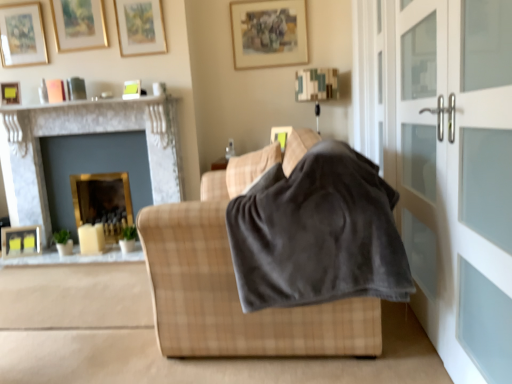
How much space does matte gold picture frame at upper center, the fifth picture frame from the left, occupy horizontally?

The width of matte gold picture frame at upper center, the fifth picture frame from the left, is 1.32 inches.

Measure the distance between point (15, 242) and camera.

Result: Point (15, 242) is 11.64 feet away from camera.

Measure the distance between point (341,336) and camera.

A distance of 5.91 feet exists between point (341,336) and camera.

Measure the distance between point (281, 143) and camera.

Point (281, 143) and camera are 2.56 meters apart from each other.

Describe the element at coordinates (281, 135) in the screenshot. I see `matte gold picture frame at center, which is the seventh picture frame in left-to-right order` at that location.

You are a GUI agent. You are given a task and a screenshot of the screen. Output one action in this format:
    pyautogui.click(x=<x>, y=<y>)
    Task: Click on the matte gold picture frame at upper center, which ranks as the third picture frame in right-to-left order
    Image resolution: width=512 pixels, height=384 pixels.
    Given the screenshot: What is the action you would take?
    pyautogui.click(x=140, y=27)

Is matte gold picture frame at center, which is the seventh picture frame in left-to-right order, touching marble fireplace at left, the second fireplace viewed from the right?

No, matte gold picture frame at center, which is the seventh picture frame in left-to-right order, is not with marble fireplace at left, the second fireplace viewed from the right.

Which of these two, matte gold picture frame at center, the sixth picture frame viewed from the top, or marble fireplace at left, the second fireplace viewed from the right, is thinner?

Thinner between the two is matte gold picture frame at center, the sixth picture frame viewed from the top.

Which of these two, matte gold picture frame at center, arranged as the 2th picture frame when ordered from the bottom, or marble fireplace at left, the second fireplace viewed from the right, is bigger?

marble fireplace at left, the second fireplace viewed from the right, is bigger.

Considering the relative sizes of matte gold picture frame at center, which is the seventh picture frame in left-to-right order, and marble fireplace at left, which appears as the first fireplace when viewed from the left, in the image provided, is matte gold picture frame at center, which is the seventh picture frame in left-to-right order, taller than marble fireplace at left, which appears as the first fireplace when viewed from the left,?

Incorrect, the height of matte gold picture frame at center, which is the seventh picture frame in left-to-right order, is not larger of that of marble fireplace at left, which appears as the first fireplace when viewed from the left.

Can you confirm if gold-framed mirror at left, the second fireplace in the left-to-right sequence, is positioned to the right of white frosted glass door at right, which is the 1th screen door in back-to-front order?

No, gold-framed mirror at left, the second fireplace in the left-to-right sequence, is not to the right of white frosted glass door at right, which is the 1th screen door in back-to-front order.

Is gold-framed mirror at left, the second fireplace in the left-to-right sequence, further to the viewer compared to white frosted glass door at right, which is the 1th screen door in back-to-front order?

That is True.

Can you tell me how much gold-framed mirror at left, marked as the 1th fireplace in a right-to-left arrangement, and white frosted glass door at right, the second screen door when ordered from front to back, differ in facing direction?

90.2 degrees separate the facing orientations of gold-framed mirror at left, marked as the 1th fireplace in a right-to-left arrangement, and white frosted glass door at right, the second screen door when ordered from front to back.

Is white frosted glass door at right, the second screen door when ordered from front to back, at the back of gold-framed mirror at left, the second fireplace in the left-to-right sequence?

No, gold-framed mirror at left, the second fireplace in the left-to-right sequence,'s orientation is not away from white frosted glass door at right, the second screen door when ordered from front to back.

Based on the photo, which object is positioned more to the right, matte black picture frame at lower left, acting as the first picture frame starting from the bottom, or gold-framed picture at upper left, the fourth picture frame in the right-to-left sequence?

gold-framed picture at upper left, the fourth picture frame in the right-to-left sequence.

Does point (24, 238) lie in front of point (54, 5)?

No.

Is matte black picture frame at lower left, marked as the 7th picture frame in a top-to-bottom arrangement, spatially inside gold-framed picture at upper left, which appears as the second picture frame when viewed from the top, or outside of it?

matte black picture frame at lower left, marked as the 7th picture frame in a top-to-bottom arrangement, is located beyond the bounds of gold-framed picture at upper left, which appears as the second picture frame when viewed from the top.

Considering the relative sizes of matte black picture frame at lower left, positioned as the fifth picture frame in right-to-left order, and gold-framed picture at upper left, the fourth picture frame in the right-to-left sequence, in the image provided, is matte black picture frame at lower left, positioned as the fifth picture frame in right-to-left order, taller than gold-framed picture at upper left, the fourth picture frame in the right-to-left sequence,?

No, matte black picture frame at lower left, positioned as the fifth picture frame in right-to-left order, is not taller than gold-framed picture at upper left, the fourth picture frame in the right-to-left sequence.

From the image's perspective, between plaid fabric couch at center and satin white screen door at right, which appears as the second screen door when viewed from the back, who is located below?

From the image's view, plaid fabric couch at center is below.

From a real-world perspective, does plaid fabric couch at center stand above satin white screen door at right, which appears as the second screen door when viewed from the back?

No, from a real-world perspective, plaid fabric couch at center is not over satin white screen door at right, which appears as the second screen door when viewed from the back

Who is shorter, plaid fabric couch at center or satin white screen door at right, which is counted as the first screen door, starting from the front?

plaid fabric couch at center is shorter.

Is plaid fabric couch at center thinner than satin white screen door at right, which is counted as the first screen door, starting from the front?

No, plaid fabric couch at center is not thinner than satin white screen door at right, which is counted as the first screen door, starting from the front.

Does plaid fabric couch at center have a greater width compared to white frosted glass door at right, which is the 1th screen door in back-to-front order?

Yes.

In terms of size, does plaid fabric couch at center appear bigger or smaller than white frosted glass door at right, which is the 1th screen door in back-to-front order?

Clearly, plaid fabric couch at center is larger in size than white frosted glass door at right, which is the 1th screen door in back-to-front order.

From a real-world perspective, is plaid fabric couch at center over white frosted glass door at right, the second screen door when ordered from front to back?

Incorrect, from a real-world perspective, plaid fabric couch at center is lower than white frosted glass door at right, the second screen door when ordered from front to back.

How distant is matte yellow picture frame at upper left, the 1th picture frame positioned from the left, from satin white screen door at right, which appears as the second screen door when viewed from the back?

3.29 meters.

How different are the orientations of matte yellow picture frame at upper left, positioned as the fifth picture frame in top-to-bottom order, and satin white screen door at right, which is counted as the first screen door, starting from the front, in degrees?

The angle between the facing direction of matte yellow picture frame at upper left, positioned as the fifth picture frame in top-to-bottom order, and the facing direction of satin white screen door at right, which is counted as the first screen door, starting from the front, is 114 degrees.

Does matte yellow picture frame at upper left, acting as the 3th picture frame starting from the bottom, lie in front of satin white screen door at right, which is counted as the first screen door, starting from the front?

No, matte yellow picture frame at upper left, acting as the 3th picture frame starting from the bottom, is further to the viewer.

Is matte yellow picture frame at upper left, acting as the 3th picture frame starting from the bottom, located outside satin white screen door at right, which is counted as the first screen door, starting from the front?

Yes.

Is gold-framed mirror at left, marked as the 1th fireplace in a right-to-left arrangement, at the back of matte yellow picture frame at upper left, positioned as the fifth picture frame in top-to-bottom order?

matte yellow picture frame at upper left, positioned as the fifth picture frame in top-to-bottom order, does not have its back to gold-framed mirror at left, marked as the 1th fireplace in a right-to-left arrangement.

Which of these two, matte yellow picture frame at upper left, positioned as the fifth picture frame in top-to-bottom order, or gold-framed mirror at left, the second fireplace in the left-to-right sequence, stands taller?

With more height is gold-framed mirror at left, the second fireplace in the left-to-right sequence.

Is matte yellow picture frame at upper left, acting as the 3th picture frame starting from the bottom, inside the boundaries of gold-framed mirror at left, the second fireplace in the left-to-right sequence, or outside?

The correct answer is: outside.

Is the position of matte yellow picture frame at upper left, acting as the 3th picture frame starting from the bottom, more distant than that of gold-framed mirror at left, marked as the 1th fireplace in a right-to-left arrangement?

No, matte yellow picture frame at upper left, acting as the 3th picture frame starting from the bottom, is closer to the viewer.

This screenshot has width=512, height=384. I want to click on fireplace that is the 2nd object to the left of the matte gold picture frame at center, the sixth picture frame viewed from the top, starting at the anchor, so click(84, 133).

From a real-world perspective, which fireplace is the 2nd one underneath the white frosted glass door at right, which is the 1th screen door in back-to-front order? Please provide its 2D coordinates.

[(103, 202)]

Looking at the image, which one is located closer to matte yellow picture frame at upper left, positioned as the fifth picture frame in top-to-bottom order, gray soft blanket at center or matte gold picture frame at upper center, the fifth picture frame from the left?

Among the two, matte gold picture frame at upper center, the fifth picture frame from the left, is located nearer to matte yellow picture frame at upper left, positioned as the fifth picture frame in top-to-bottom order.

Based on their spatial positions, is marble fireplace at left, which appears as the first fireplace when viewed from the left, or matte gold picture frame at center, the sixth picture frame viewed from the top, closer to wooden framed artwork at upper center, which is counted as the sixth picture frame, starting from the left?

marble fireplace at left, which appears as the first fireplace when viewed from the left, is closer to wooden framed artwork at upper center, which is counted as the sixth picture frame, starting from the left.

Which object lies nearer to the anchor point matte yellow picture frame at upper left, the 1th picture frame positioned from the left, matte gold picture frame at upper center, the fifth picture frame from the left, or white frosted glass door at right, the second screen door when ordered from front to back?

The object closer to matte yellow picture frame at upper left, the 1th picture frame positioned from the left, is matte gold picture frame at upper center, the fifth picture frame from the left.

When comparing their distances from wooden framed artwork at upper center, which is counted as the sixth picture frame, starting from the left, does marble fireplace at left, the second fireplace viewed from the right, or white frosted glass door at right, which is the 1th screen door in back-to-front order, seem closer?

Among the two, marble fireplace at left, the second fireplace viewed from the right, is located nearer to wooden framed artwork at upper center, which is counted as the sixth picture frame, starting from the left.

From the image, which object appears to be nearer to matte white shelf at upper center, plaid fabric couch at center or matte gold picture frame at upper center, which is the fifth picture frame from bottom to top?

matte gold picture frame at upper center, which is the fifth picture frame from bottom to top, is positioned closer to the anchor matte white shelf at upper center.

Which object lies nearer to the anchor point gold-framed mirror at left, the second fireplace in the left-to-right sequence, matte white shelf at upper center or marble fireplace at left, the second fireplace viewed from the right?

marble fireplace at left, the second fireplace viewed from the right, lies closer to gold-framed mirror at left, the second fireplace in the left-to-right sequence, than the other object.

Considering their positions, is marble fireplace at left, which appears as the first fireplace when viewed from the left, positioned closer to satin white screen door at right, which appears as the second screen door when viewed from the back, than matte gold picture frame at upper center, the fifth picture frame from the left?

marble fireplace at left, which appears as the first fireplace when viewed from the left, is positioned closer to the anchor satin white screen door at right, which appears as the second screen door when viewed from the back.

From the image, which object appears to be nearer to matte yellow picture frame at upper left, positioned as the fifth picture frame in top-to-bottom order, satin white screen door at right, which appears as the second screen door when viewed from the back, or marble fireplace at left, the second fireplace viewed from the right?

marble fireplace at left, the second fireplace viewed from the right, is closer to matte yellow picture frame at upper left, positioned as the fifth picture frame in top-to-bottom order.

Image resolution: width=512 pixels, height=384 pixels. In order to click on studio couch situated between gold-framed picture at upper left, the 4th picture frame in the top-to-bottom sequence, and wooden framed artwork at upper center, which is counted as the sixth picture frame, starting from the left, from left to right in this screenshot , I will do `click(234, 285)`.

Find the location of `fireplace positioned between satin white screen door at right, which is counted as the first screen door, starting from the front, and matte yellow picture frame at upper left, positioned as the fifth picture frame in top-to-bottom order, from near to far`. fireplace positioned between satin white screen door at right, which is counted as the first screen door, starting from the front, and matte yellow picture frame at upper left, positioned as the fifth picture frame in top-to-bottom order, from near to far is located at coordinates (84, 133).

Locate an element on the screen. This screenshot has height=384, width=512. fireplace located between plaid fabric couch at center and matte black picture frame at lower left, positioned as the fifth picture frame in right-to-left order, in the depth direction is located at coordinates (84, 133).

The height and width of the screenshot is (384, 512). In order to click on fireplace located between gray soft blanket at center and gold-framed picture at upper left, which appears as the second picture frame when viewed from the top, in the depth direction in this screenshot , I will do `click(84, 133)`.